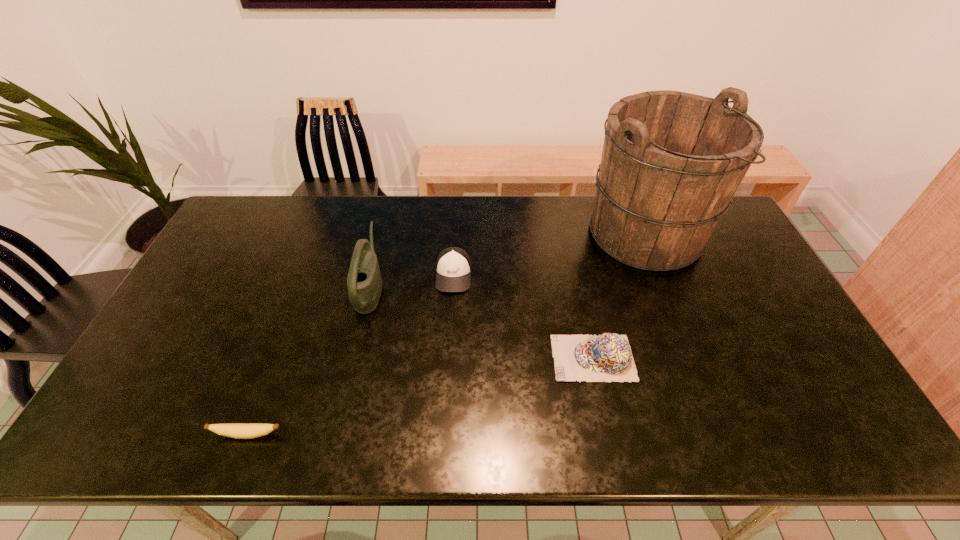
Where is `free space located 0.390m on the spout of the fourth shortest object`? free space located 0.390m on the spout of the fourth shortest object is located at coordinates (513, 287).

Locate an element on the screen. free location located 0.100m on the front panel of the left cap is located at coordinates (451, 321).

In order to click on vacant space situated 0.240m on the front, side, and top of the right cap in this screenshot , I will do `click(461, 358)`.

I want to click on free space located 0.320m on the front, side, and top of the right cap, so click(x=430, y=358).

At what (x,y) coordinates should I click in order to perform the action: click on vacant point located on the front, side, and top of the right cap. Please return your answer as a coordinate pair (x, y). Looking at the image, I should click on (453, 358).

The height and width of the screenshot is (540, 960). What are the coordinates of `vacant region located on the right of the shortest object` in the screenshot? It's located at (332, 435).

Identify the location of object that is at the far edge. (672, 161).

The width and height of the screenshot is (960, 540). I want to click on object situated at the near edge, so click(x=234, y=430).

You are a GUI agent. You are given a task and a screenshot of the screen. Output one action in this format:
    pyautogui.click(x=<x>, y=<y>)
    Task: Click on the object at the right edge
    This screenshot has width=960, height=540.
    Given the screenshot: What is the action you would take?
    pyautogui.click(x=672, y=161)

Identify the location of object that is at the far right corner. The width and height of the screenshot is (960, 540). (672, 161).